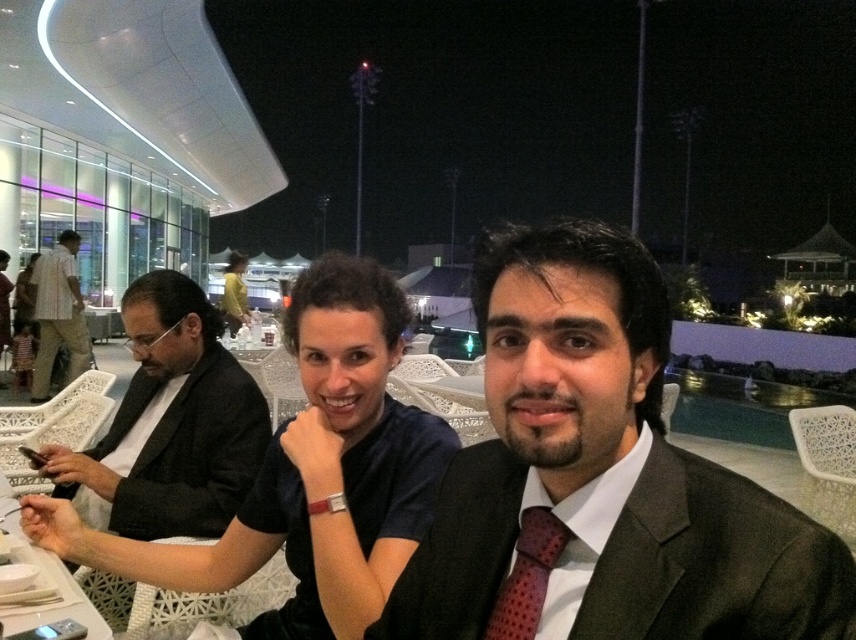
Does matte black suit at center appear on the right side of matte black suit at left?

Indeed, matte black suit at center is positioned on the right side of matte black suit at left.

How much distance is there between matte black suit at center and matte black suit at left?

They are 7.33 meters apart.

This screenshot has height=640, width=856. Describe the element at coordinates (599, 477) in the screenshot. I see `matte black suit at center` at that location.

The height and width of the screenshot is (640, 856). Identify the location of matte black suit at center. (599, 477).

Is point (515, 556) more distant than point (64, 598)?

No, (515, 556) is closer to viewer.

Between matte black suit at center and white plastic table at lower left, which one is positioned lower?

white plastic table at lower left

You are a GUI agent. You are given a task and a screenshot of the screen. Output one action in this format:
    pyautogui.click(x=<x>, y=<y>)
    Task: Click on the matte black suit at center
    Image resolution: width=856 pixels, height=640 pixels.
    Given the screenshot: What is the action you would take?
    pyautogui.click(x=599, y=477)

Who is taller, matte black suit at left or polka dot silk tie at center?

Standing taller between the two is matte black suit at left.

What are the coordinates of `matte black suit at left` in the screenshot? It's located at (58, 314).

Locate an element on the screen. Image resolution: width=856 pixels, height=640 pixels. matte black suit at left is located at coordinates (58, 314).